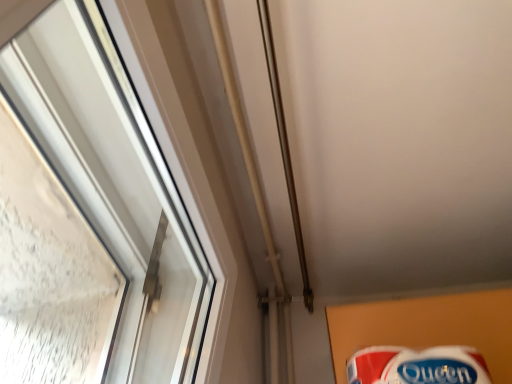
What do you see at coordinates (114, 184) in the screenshot? I see `white glossy window at upper left` at bounding box center [114, 184].

Find the location of `white glossy window at upper left`. white glossy window at upper left is located at coordinates 114,184.

Where is `white glossy window at upper left`? This screenshot has width=512, height=384. white glossy window at upper left is located at coordinates (114, 184).